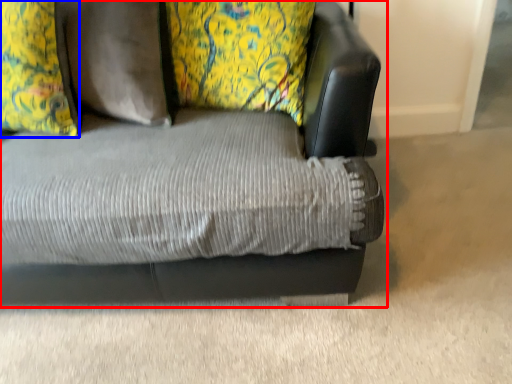
Question: Which point is closer to the camera, studio couch (highlighted by a red box) or pillow (highlighted by a blue box)?

Choices:
 (A) studio couch
 (B) pillow

Answer: (A)